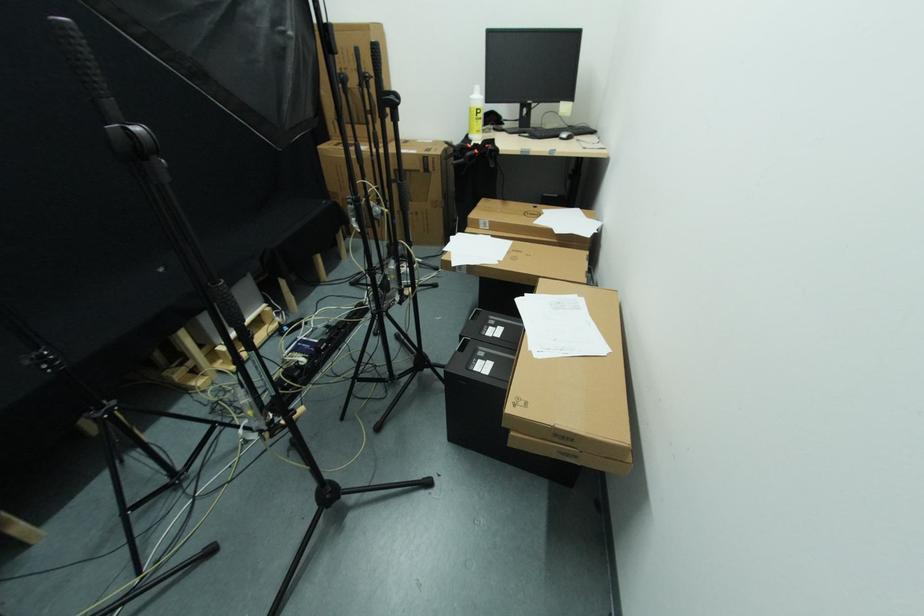
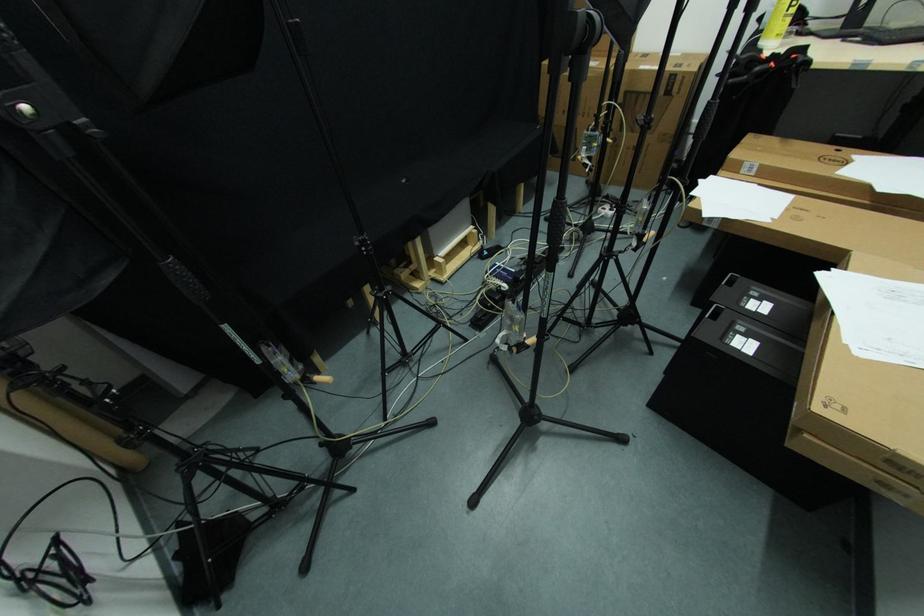
Question: In a continuous first-person perspective shot, in which direction is the camera moving?

Choices:
 (A) Left
 (B) Right
 (C) Forward
 (D) Backward

Answer: (A)